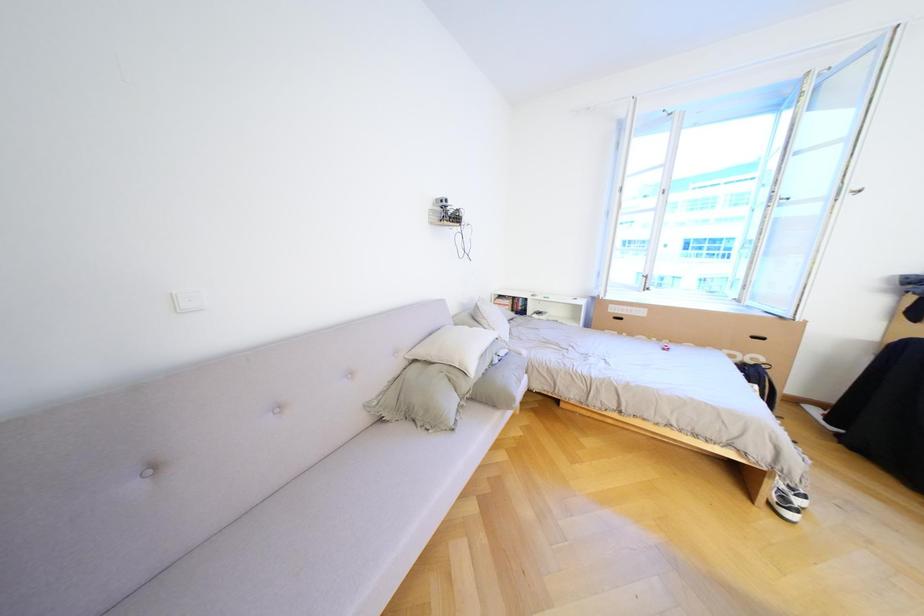
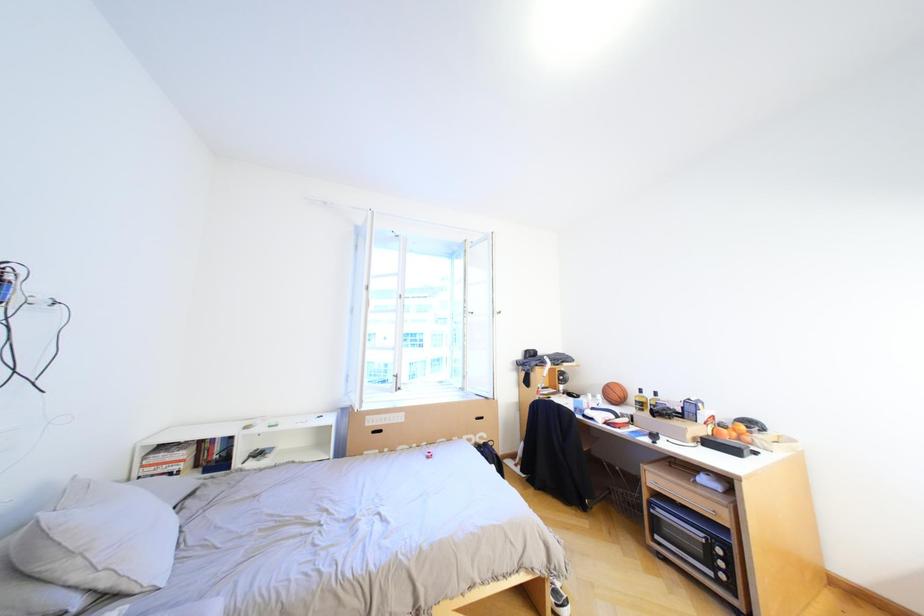
Question: Based on the continuous images, in which direction is the camera rotating? Reply with the corresponding letter.

Choices:
 (A) Left
 (B) Right
 (C) Up
 (D) Down

Answer: (B)